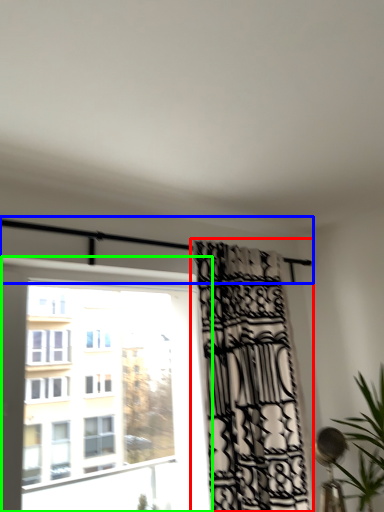
Question: Estimate the real-world distances between objects in this image. Which object is closer to curtain (highlighted by a red box), balcony (highlighted by a blue box) or window (highlighted by a green box)?

Choices:
 (A) balcony
 (B) window

Answer: (A)